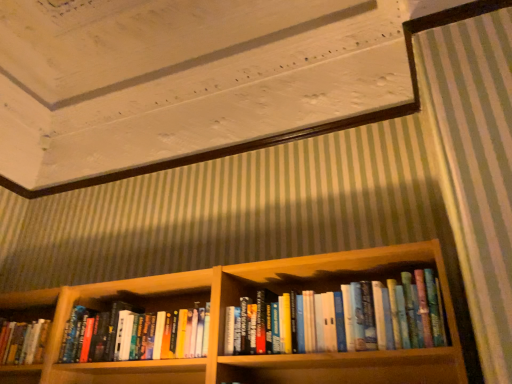
Question: Can you confirm if wooden bookshelf at center is wider than hardcover books at center?

Choices:
 (A) yes
 (B) no

Answer: (A)

Question: Is wooden bookshelf at center to the left of hardcover books at center from the viewer's perspective?

Choices:
 (A) no
 (B) yes

Answer: (B)

Question: From the image's perspective, is wooden bookshelf at center on hardcover books at center?

Choices:
 (A) no
 (B) yes

Answer: (A)

Question: Is wooden bookshelf at center not within hardcover books at center?

Choices:
 (A) yes
 (B) no

Answer: (A)

Question: From a real-world perspective, is wooden bookshelf at center positioned under hardcover books at center based on gravity?

Choices:
 (A) no
 (B) yes

Answer: (A)

Question: From the image's perspective, is wooden bookshelf at center located above or below wooden bookshelf at lower left?

Choices:
 (A) below
 (B) above

Answer: (B)

Question: Based on their positions, is wooden bookshelf at center located to the left or right of wooden bookshelf at lower left?

Choices:
 (A) right
 (B) left

Answer: (A)

Question: Would you say wooden bookshelf at center is inside or outside wooden bookshelf at lower left?

Choices:
 (A) inside
 (B) outside

Answer: (B)

Question: Is wooden bookshelf at center wider or thinner than wooden bookshelf at lower left?

Choices:
 (A) wide
 (B) thin

Answer: (A)

Question: From a real-world perspective, is wooden bookshelf at lower left positioned above or below hardcover books at center?

Choices:
 (A) below
 (B) above

Answer: (A)

Question: Considering the relative positions of wooden bookshelf at lower left and hardcover books at center in the image provided, is wooden bookshelf at lower left to the left or to the right of hardcover books at center?

Choices:
 (A) left
 (B) right

Answer: (A)

Question: Is wooden bookshelf at lower left taller or shorter than hardcover books at center?

Choices:
 (A) short
 (B) tall

Answer: (A)

Question: Is wooden bookshelf at lower left situated inside hardcover books at center or outside?

Choices:
 (A) inside
 (B) outside

Answer: (B)

Question: From their relative heights in the image, would you say hardcover books at center is taller or shorter than wooden bookshelf at center?

Choices:
 (A) short
 (B) tall

Answer: (A)

Question: From the image's perspective, is hardcover books at center above or below wooden bookshelf at center?

Choices:
 (A) above
 (B) below

Answer: (A)